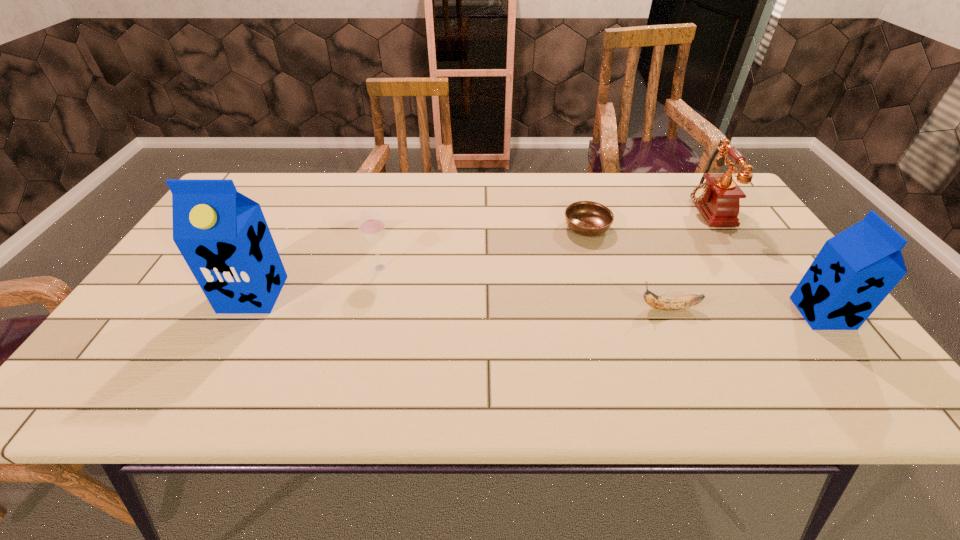
Identify the location of spot to insert another carton for uniform distribution. This screenshot has height=540, width=960. (532, 303).